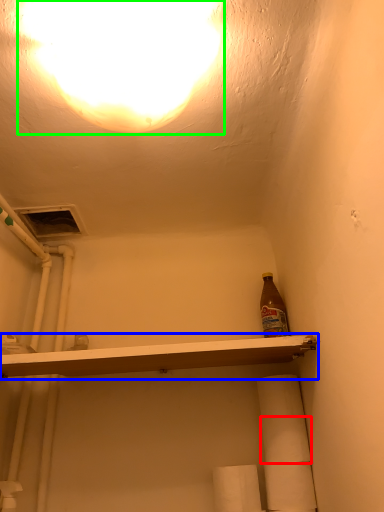
Question: Which object is positioned closest to toilet paper (highlighted by a red box)? Select from shelf (highlighted by a blue box) and light (highlighted by a green box).

Choices:
 (A) shelf
 (B) light

Answer: (A)